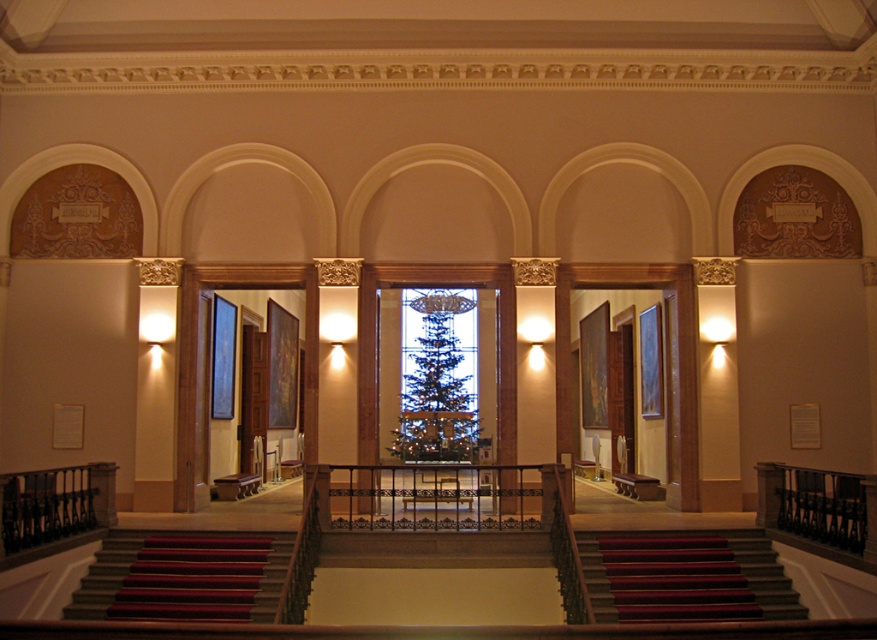
From the picture: Does dark gray carpeted stairs at center have a greater width compared to red carpeted stairs at lower left?

Yes.

Find the location of `dark gray carpeted stairs at center`. dark gray carpeted stairs at center is located at coordinates (685, 577).

Locate an element on the screen. The image size is (877, 640). dark gray carpeted stairs at center is located at coordinates (685, 577).

Is dark red carpeted stairs at lower center closer to camera compared to red carpeted stairs at lower left?

Yes, it is.

Can you confirm if dark red carpeted stairs at lower center is positioned to the left of red carpeted stairs at lower left?

No, dark red carpeted stairs at lower center is not to the left of red carpeted stairs at lower left.

Where is `dark red carpeted stairs at lower center`? dark red carpeted stairs at lower center is located at coordinates (685, 577).

Does dark red carpeted stairs at lower center have a lesser width compared to green stained glass window at center?

No.

Who is more distant from viewer, (583, 566) or (401, 396)?

The point (401, 396) is more distant.

Find the location of a particular element. The image size is (877, 640). dark red carpeted stairs at lower center is located at coordinates (685, 577).